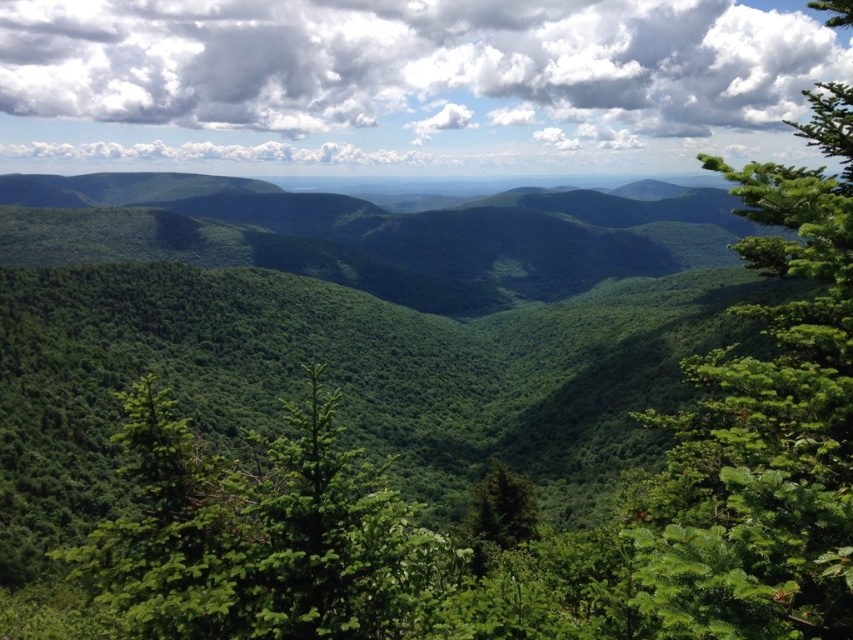
You are a hiker standing at the base of the mountain and looking at the green leafy forest at center and the green leafy tree at right. Which object is positioned higher in the image?

The green leafy forest at center is located above the green leafy tree at right, so it is positioned higher in the image.

You are standing in the mountain landscape and want to walk from the green leafy forest at center to the green leafy tree at right. Which direction should you head?

You should head to the right because the green leafy forest at center is to the left of the green leafy tree at right.